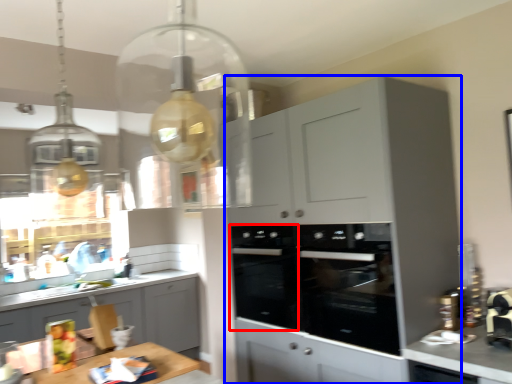
Question: Which point is further to the camera, oven (highlighted by a red box) or cabinetry (highlighted by a blue box)?

Choices:
 (A) oven
 (B) cabinetry

Answer: (A)